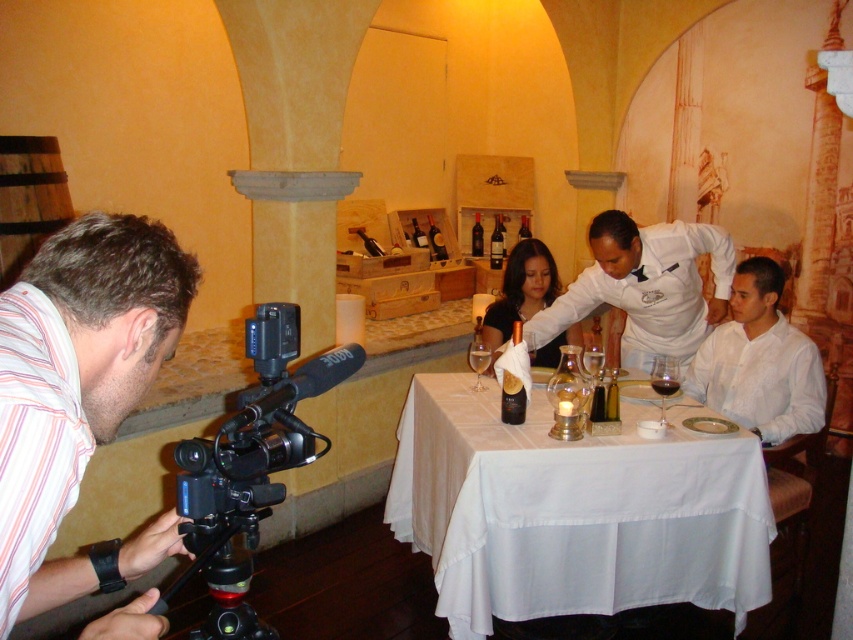
Which is behind, point (677, 381) or point (479, 253)?

The point (479, 253) is more distant.

In the scene shown: Does red glass wine at table center have a lesser height compared to dark red glass bottle at center?

Indeed, red glass wine at table center has a lesser height compared to dark red glass bottle at center.

What do you see at coordinates (664, 387) in the screenshot? This screenshot has width=853, height=640. I see `red glass wine at table center` at bounding box center [664, 387].

Image resolution: width=853 pixels, height=640 pixels. Identify the location of red glass wine at table center. click(x=664, y=387).

Between point (701, 508) and point (534, 266), which one is positioned behind?

Point (534, 266)

Does white cloth table at center have a larger size compared to matte black dress at center?

Yes.

Where is `white cloth table at center`? This screenshot has height=640, width=853. white cloth table at center is located at coordinates (573, 509).

The width and height of the screenshot is (853, 640). Identify the location of white cloth table at center. (573, 509).

Does black plastic video camera at lower left have a larger size compared to clear glass wine glass at table center?

Yes, black plastic video camera at lower left is bigger than clear glass wine glass at table center.

Is black plastic video camera at lower left positioned in front of clear glass wine glass at table center?

Yes.

Which is in front, point (184, 508) or point (601, 376)?

Point (184, 508) is in front.

Where is `black plastic video camera at lower left`? black plastic video camera at lower left is located at coordinates (248, 467).